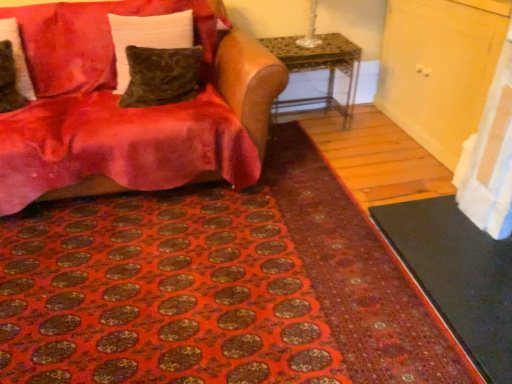
Question: In the image, is velvet green pillow at upper left, the 2th pillow from the left, positioned in front of or behind metallic mosaic table at center?

Choices:
 (A) behind
 (B) front

Answer: (B)

Question: From the image's perspective, relative to metallic mosaic table at center, is velvet green pillow at upper left, which appears as the second pillow when viewed from the right, above or below?

Choices:
 (A) below
 (B) above

Answer: (B)

Question: Based on their relative distances, which object is farther from the velvet red couch at upper left?

Choices:
 (A) velvet brown pillow at left, which ranks as the first pillow in left-to-right order
 (B) velvet green pillow at center, the 3th pillow positioned from the left
 (C) velvet green pillow at upper left, the 2th pillow from the left
 (D) black rubber doormat at lower right
 (E) metallic mosaic table at center

Answer: (D)

Question: Considering the real-world distances, which object is farthest from the metallic mosaic table at center?

Choices:
 (A) velvet red couch at upper left
 (B) velvet green pillow at upper left, the 2th pillow from the left
 (C) velvet brown pillow at left, the third pillow in the right-to-left sequence
 (D) velvet green pillow at center, the 3th pillow positioned from the left
 (E) black rubber doormat at lower right

Answer: (C)